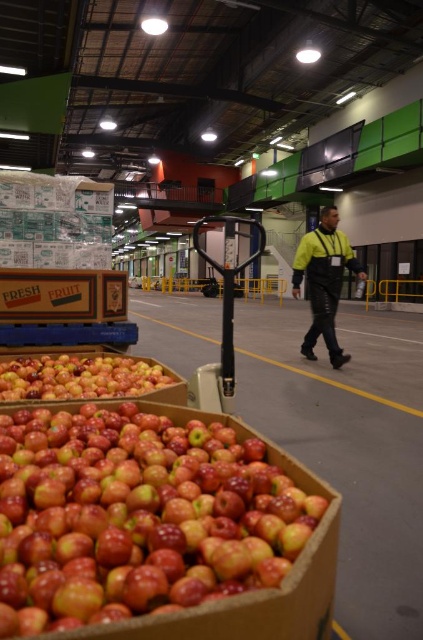
Question: Observing the image, what is the correct spatial positioning of shiny red apples at lower left in reference to yellow reflective jacket at center?

Choices:
 (A) left
 (B) right

Answer: (A)

Question: Which point is farther from the camera taking this photo?

Choices:
 (A) (5, 384)
 (B) (338, 253)

Answer: (B)

Question: Which object is positioned farthest from the glossy red apples at center?

Choices:
 (A) yellow reflective jacket at center
 (B) shiny red apples at lower left

Answer: (A)

Question: Which point is closer to the camera?

Choices:
 (A) shiny red apples at lower left
 (B) yellow reflective jacket at center

Answer: (A)

Question: Can you confirm if shiny red apples at lower left is bigger than glossy red apples at center?

Choices:
 (A) no
 (B) yes

Answer: (B)

Question: Is shiny red apples at lower left to the right of yellow reflective jacket at center from the viewer's perspective?

Choices:
 (A) yes
 (B) no

Answer: (B)